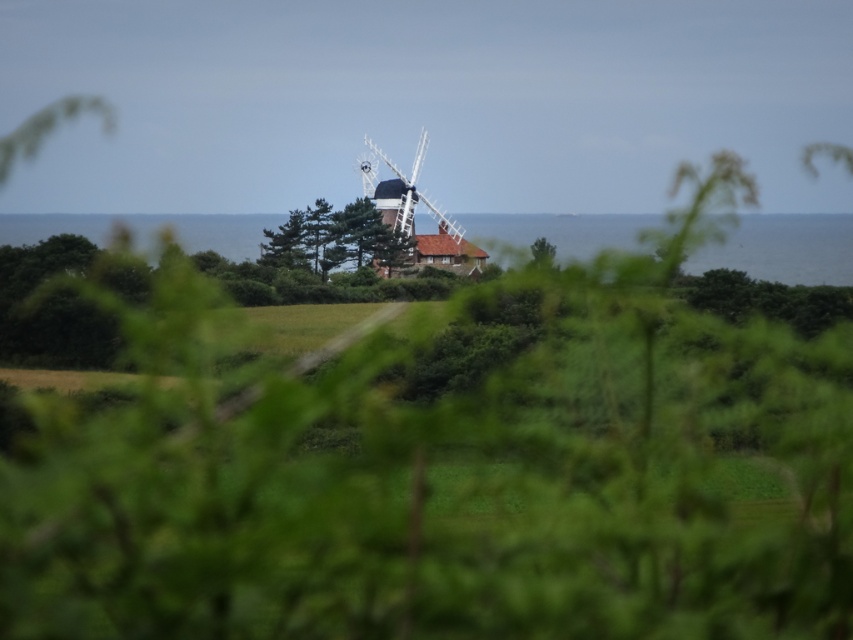
Question: Is green leafy tree at center bigger than white wooden windmill at center?

Choices:
 (A) no
 (B) yes

Answer: (A)

Question: Which point appears farthest from the camera in this image?

Choices:
 (A) (380, 220)
 (B) (498, 259)

Answer: (B)

Question: Among these points, which one is farthest from the camera?

Choices:
 (A) (331, 243)
 (B) (363, 163)

Answer: (B)

Question: Does blue water at center appear under white wooden windmill at center?

Choices:
 (A) no
 (B) yes

Answer: (B)

Question: Which point is farther to the camera?

Choices:
 (A) (374, 179)
 (B) (361, 250)

Answer: (A)

Question: Does green leafy tree at center have a lesser width compared to white wooden windmill at center?

Choices:
 (A) yes
 (B) no

Answer: (B)